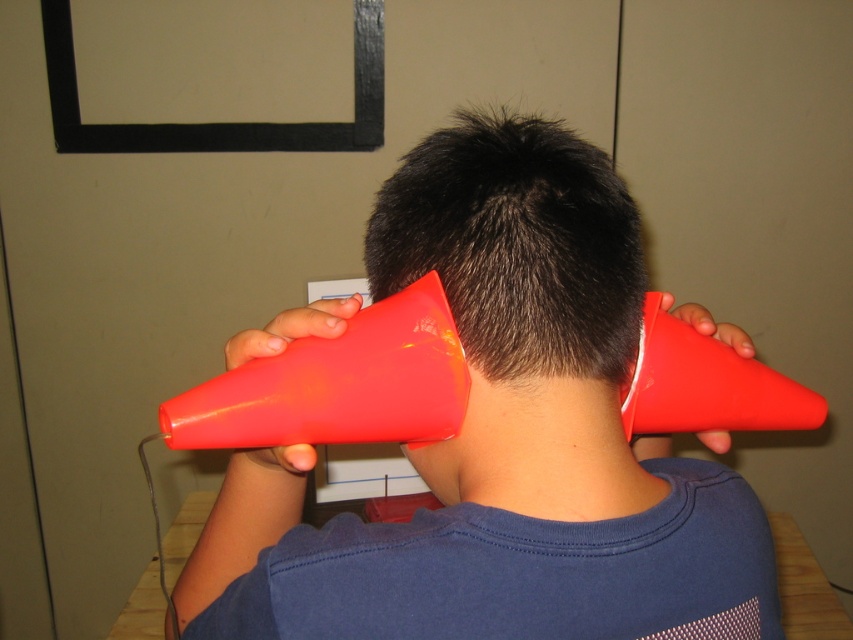
Is point (474, 259) closer to viewer compared to point (601, 371)?

Yes, point (474, 259) is closer to viewer.

Does glossy plastic cones at upper center appear under dark matte hair at center?

Correct, glossy plastic cones at upper center is located below dark matte hair at center.

The width and height of the screenshot is (853, 640). I want to click on glossy plastic cones at upper center, so click(502, 440).